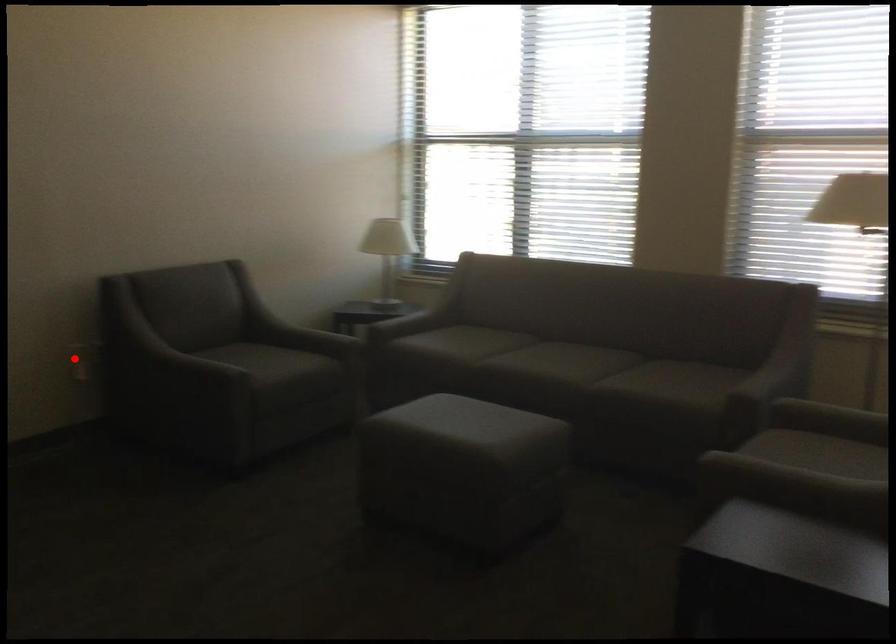
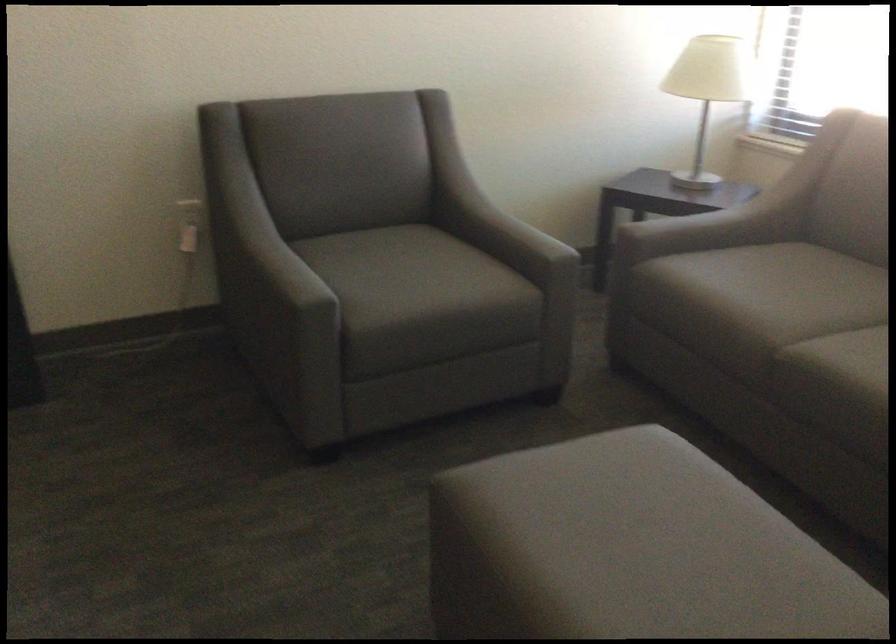
Locate, in the second image, the point that corresponds to the highlighted location in the first image.

(188, 225)